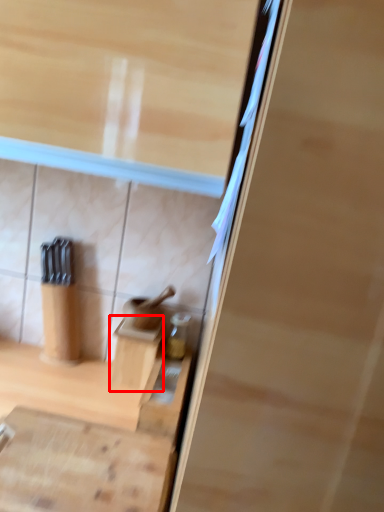
Question: From the image's perspective, where is cabinetry (annotated by the red box) located relative to cabinetry?

Choices:
 (A) above
 (B) below

Answer: (A)